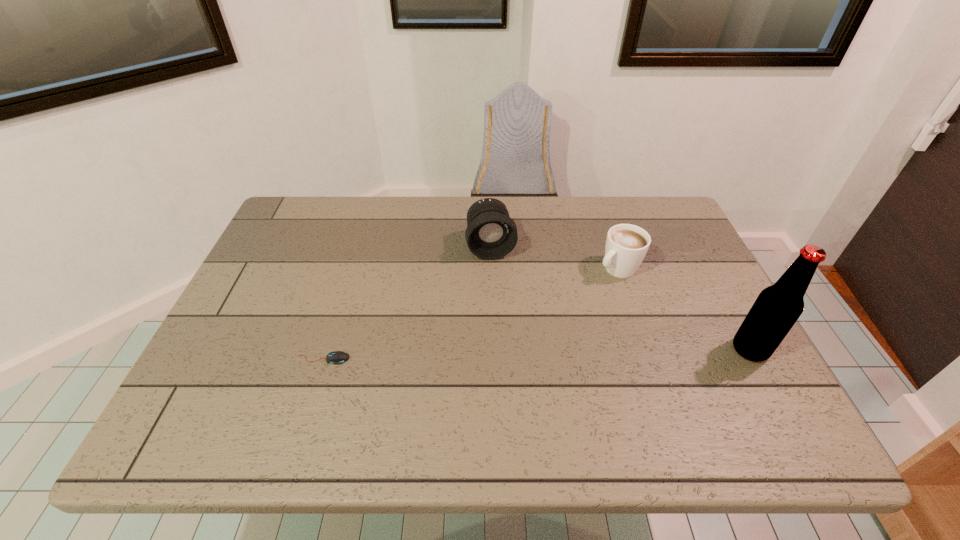
Image resolution: width=960 pixels, height=540 pixels. What are the coordinates of `mouse` in the screenshot? It's located at (336, 357).

The width and height of the screenshot is (960, 540). I want to click on the shortest object, so click(x=336, y=357).

Find the location of `beer bottle`. beer bottle is located at coordinates (777, 308).

Find the location of a particular element. This screenshot has width=960, height=540. the tallest object is located at coordinates (777, 308).

Where is `the second object from left to right`? The height and width of the screenshot is (540, 960). the second object from left to right is located at coordinates (490, 234).

Image resolution: width=960 pixels, height=540 pixels. Identify the location of the second tallest object. (490, 234).

This screenshot has width=960, height=540. I want to click on cappuccino, so click(626, 245).

The width and height of the screenshot is (960, 540). I want to click on the second object from right to left, so click(x=626, y=245).

Identify the location of free spot located on the left of the leftmost object. Image resolution: width=960 pixels, height=540 pixels. (227, 359).

Where is `free point located 0.290m on the back of the beer bottle`? This screenshot has height=540, width=960. free point located 0.290m on the back of the beer bottle is located at coordinates (699, 255).